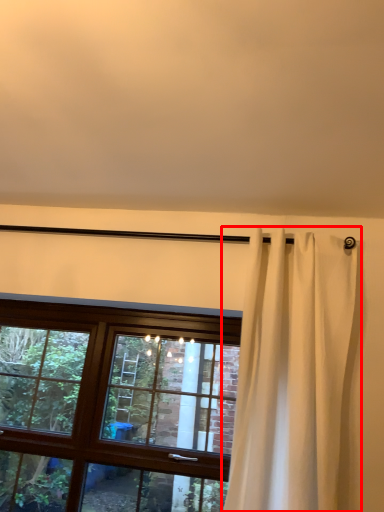
Question: From the image's perspective, where is curtain (annotated by the red box) located relative to window?

Choices:
 (A) below
 (B) above

Answer: (B)